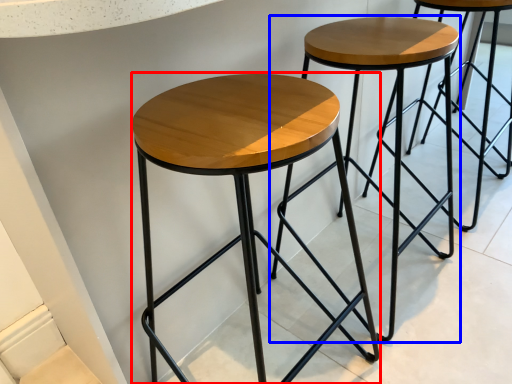
Question: Which point is closer to the camera, stool (highlighted by a red box) or stool (highlighted by a blue box)?

Choices:
 (A) stool
 (B) stool

Answer: (A)